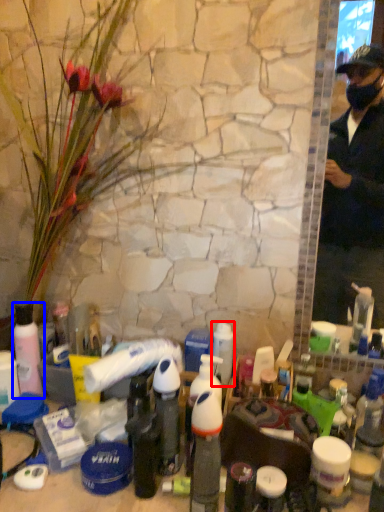
Question: Which object appears farthest to the camera in this image, toiletry (highlighted by a red box) or bottle (highlighted by a blue box)?

Choices:
 (A) toiletry
 (B) bottle

Answer: (B)